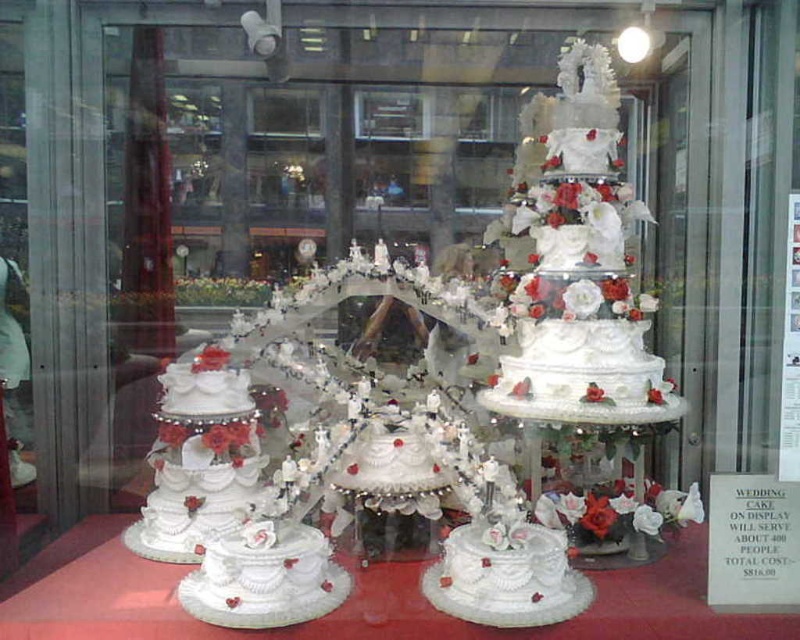
You are a customer at the bakery and want to buy the tallest cake. Looking at the display, which cake should you choose between the white textured cake at center and the white glossy cake at center?

The white textured cake at center is taller than the white glossy cake at center, so you should choose the white textured cake at center.

You are a baker who needs to retrieve the white textured cake at center from the display shelf. If you can reach up to 1.5 meters, will you be able to reach it?

The white textured cake at center is 1.37 meters away from the viewer, which is within your reach of 1.5 meters. Therefore, you can reach it.

You are a customer at the bakery and want to take a photo of both the white textured cake at center and the white glossy cake at center. Since you want both in focus, which cake should you focus on first to ensure proper depth of field?

You should focus on the white textured cake at center first because it is closer to you than the white glossy cake at center, allowing the depth of field to extend to the farther cake.